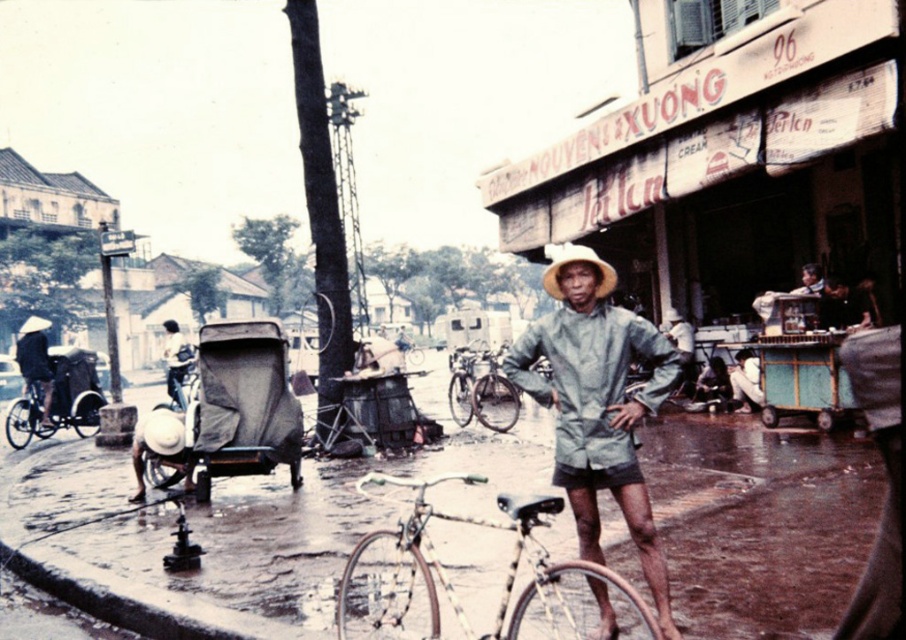
Question: Estimate the real-world distances between objects in this image. Which object is closer to the silver metallic bicycle at center?

Choices:
 (A) light brown straw hat at left
 (B) light brown leather jacket at center
 (C) natural straw hat at center

Answer: (C)

Question: Is light brown straw hat at left wider than light brown leather jacket at center?

Choices:
 (A) no
 (B) yes

Answer: (B)

Question: Which of the following is the closest to the observer?

Choices:
 (A) (42, 406)
 (B) (576, 627)
 (C) (811, 289)
 (D) (552, 276)

Answer: (B)

Question: Among these objects, which one is farthest from the camera?

Choices:
 (A) light gray fabric raincoat at center
 (B) light brown leather jacket at center
 (C) light brown straw hat at left

Answer: (C)

Question: Considering the relative positions of natural straw hat at center and light brown leather jacket at center in the image provided, where is natural straw hat at center located with respect to light brown leather jacket at center?

Choices:
 (A) below
 (B) above

Answer: (B)

Question: Can you confirm if silver metallic bicycle at center is positioned to the left of light brown leather jacket at center?

Choices:
 (A) no
 (B) yes

Answer: (B)